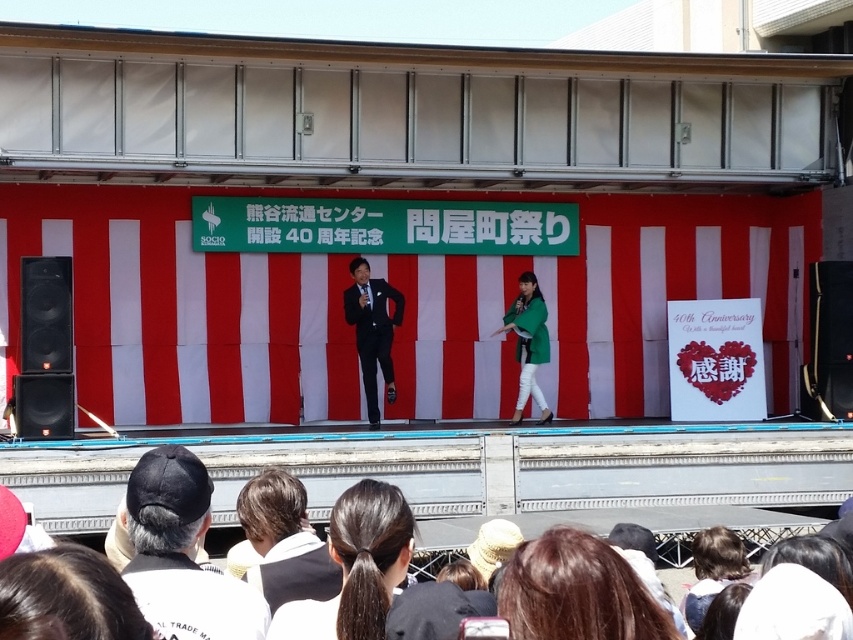
Question: Which of the following is the farthest from the observer?

Choices:
 (A) (263, 518)
 (B) (537, 346)

Answer: (B)

Question: Which object is the farthest from the dark brown hair at center?

Choices:
 (A) brown leather jacket at lower center
 (B) black fabric cap at lower left

Answer: (A)

Question: Which object is positioned farthest from the black fabric cap at lower left?

Choices:
 (A) brown hair at lower center
 (B) green matte jacket at center
 (C) matte black suit at center
 (D) brown leather jacket at lower center

Answer: (B)

Question: In this image, where is black fabric cap at lower left located relative to matte black suit at center?

Choices:
 (A) above
 (B) below

Answer: (B)

Question: Does dark brown hair at center have a larger size compared to green matte jacket at center?

Choices:
 (A) no
 (B) yes

Answer: (A)

Question: Does brown hair at lower center have a greater width compared to dark brown hair at center?

Choices:
 (A) yes
 (B) no

Answer: (A)